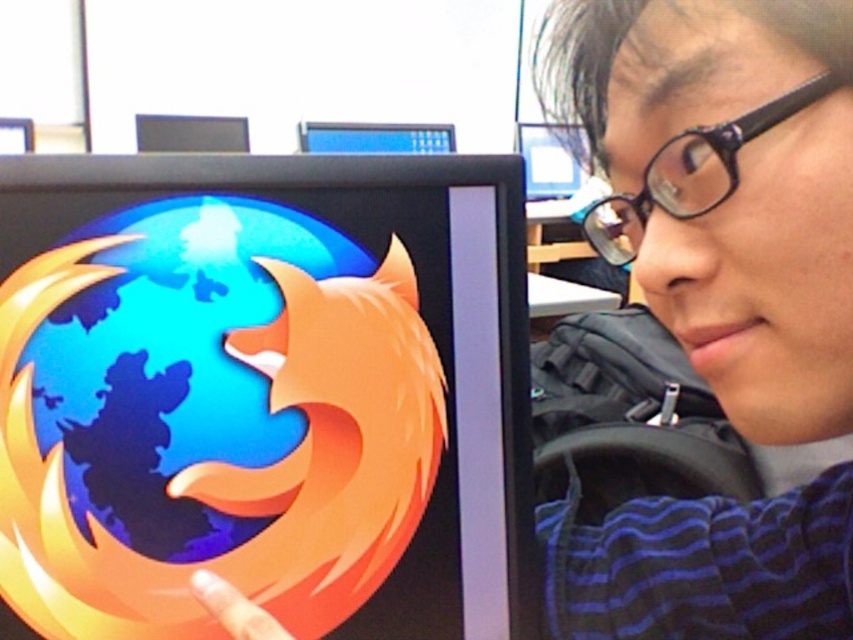
Who is taller, glossy plastic firefox logo at center or glossy plastic finger at lower left?

glossy plastic firefox logo at center

Can you confirm if glossy plastic firefox logo at center is positioned above glossy plastic finger at lower left?

Yes, glossy plastic firefox logo at center is above glossy plastic finger at lower left.

Which is behind, point (151, 244) or point (236, 612)?

Positioned behind is point (151, 244).

This screenshot has width=853, height=640. Identify the location of glossy plastic firefox logo at center. (264, 394).

Between point (572, 193) and point (247, 611), which one is positioned in front?

Point (247, 611) is more forward.

I want to click on matte black monitor at upper center, so click(x=550, y=157).

Does point (554, 141) come in front of point (281, 632)?

That is False.

Locate an element on the screen. The width and height of the screenshot is (853, 640). matte black monitor at upper center is located at coordinates (550, 157).

Can you confirm if blue glossy monitor at upper center is positioned below black glossy monitor at upper center?

No.

Who is shorter, blue glossy monitor at upper center or black glossy monitor at upper center?

black glossy monitor at upper center is shorter.

At what (x,y) coordinates should I click in order to perform the action: click on blue glossy monitor at upper center. Please return your answer as a coordinate pair (x, y). The image size is (853, 640). Looking at the image, I should click on (375, 138).

The image size is (853, 640). I want to click on blue glossy monitor at upper center, so click(375, 138).